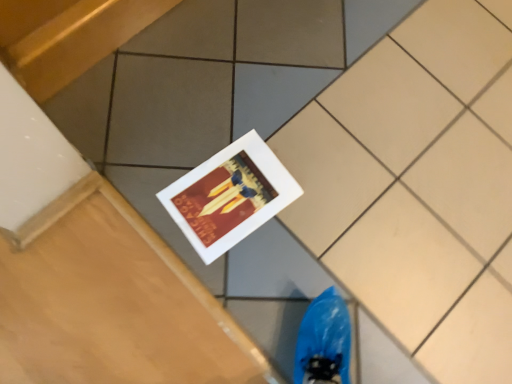
What do you see at coordinates (229, 196) in the screenshot?
I see `white matte picture frame at center` at bounding box center [229, 196].

What is the approximate width of white matte picture frame at center?

11.58 inches.

This screenshot has height=384, width=512. I want to click on white matte picture frame at center, so click(229, 196).

The width and height of the screenshot is (512, 384). I want to click on white matte picture frame at center, so click(x=229, y=196).